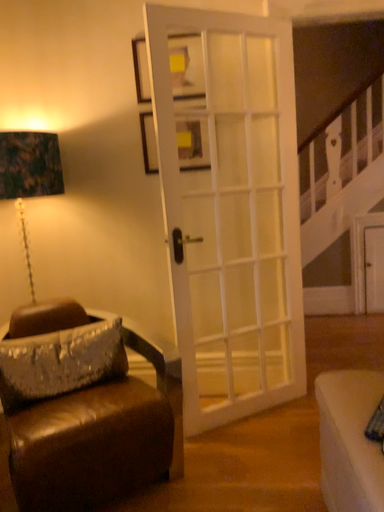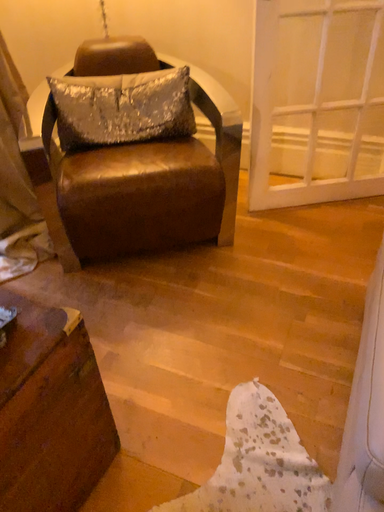
Question: How did the camera likely rotate when shooting the video?

Choices:
 (A) rotated downward
 (B) rotated upward

Answer: (A)